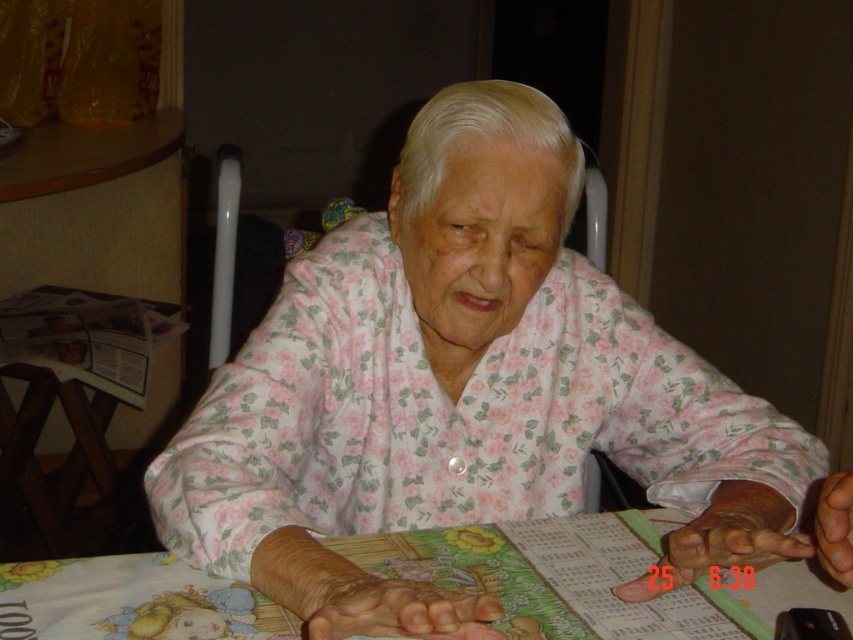
Is floral fabric at center to the left of dry skin at lower center from the viewer's perspective?

Incorrect, floral fabric at center is not on the left side of dry skin at lower center.

Does point (563, 477) come in front of point (447, 609)?

That is False.

Locate an element on the screen. The image size is (853, 640). floral fabric at center is located at coordinates (467, 378).

Find the location of a particular element. floral fabric tablecloth at center is located at coordinates (585, 579).

Does floral fabric tablecloth at center appear under dry skin at lower center?

Yes, floral fabric tablecloth at center is below dry skin at lower center.

Who is more distant from viewer, (169, 561) or (305, 600)?

Positioned behind is point (169, 561).

Image resolution: width=853 pixels, height=640 pixels. What are the coordinates of `floral fabric tablecloth at center` in the screenshot? It's located at (585, 579).

Who is higher up, floral fabric at center or smooth skin hand at center?

floral fabric at center is higher up.

Is floral fabric at center to the left of smooth skin hand at center from the viewer's perspective?

Yes, floral fabric at center is to the left of smooth skin hand at center.

What do you see at coordinates (467, 378) in the screenshot? Image resolution: width=853 pixels, height=640 pixels. I see `floral fabric at center` at bounding box center [467, 378].

This screenshot has height=640, width=853. I want to click on floral fabric at center, so click(x=467, y=378).